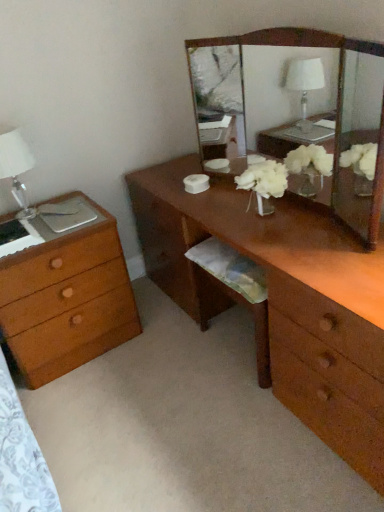
What are the coordinates of `free spot to the left of wooden mirror at center` in the screenshot? It's located at (206, 204).